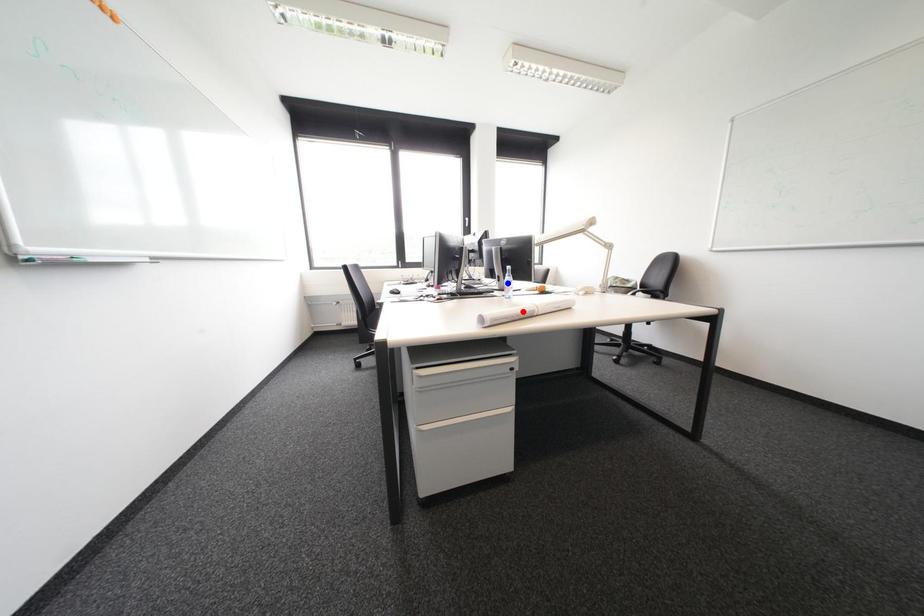
Question: Two points are marked on the image. Which point is closer to the camera?

Choices:
 (A) Blue point is closer.
 (B) Red point is closer.

Answer: (B)